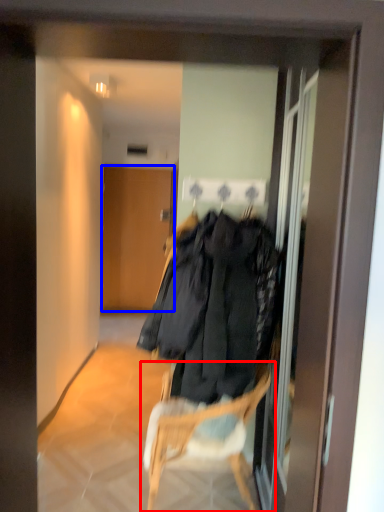
Question: Among these objects, which one is farthest to the camera, chair (highlighted by a red box) or door (highlighted by a blue box)?

Choices:
 (A) chair
 (B) door

Answer: (B)